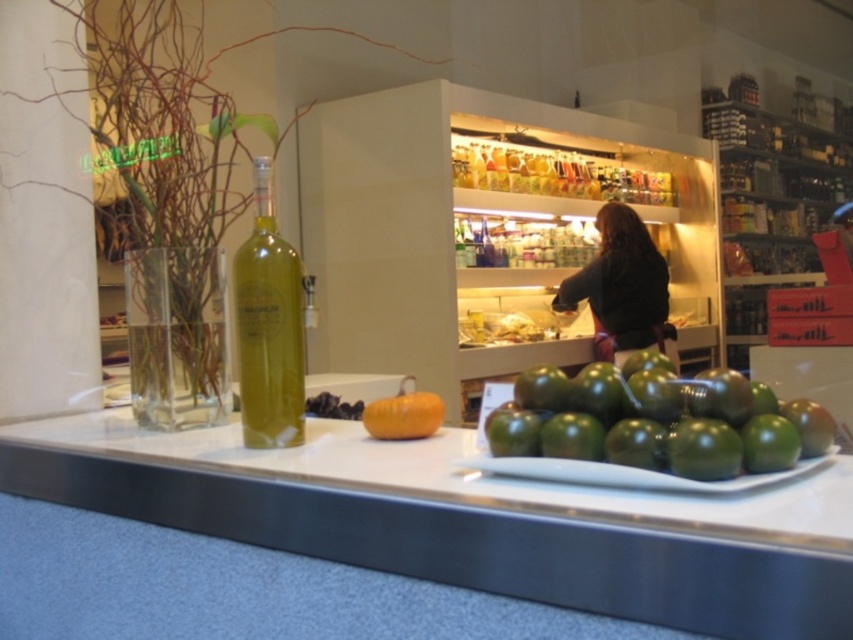
Question: Does green matte tomatoes at center lie behind black fabric at center?

Choices:
 (A) no
 (B) yes

Answer: (A)

Question: Considering the real-world distances, which object is closest to the green glass bottle at center?

Choices:
 (A) black fabric at center
 (B) orange matte pumpkin at center
 (C) white glossy counter at center

Answer: (B)

Question: In this image, where is white glossy counter at center located relative to green matte tomatoes at center?

Choices:
 (A) above
 (B) below

Answer: (B)

Question: Among these objects, which one is nearest to the camera?

Choices:
 (A) green matte tomatoes at center
 (B) orange matte pumpkin at center
 (C) green glass bottle at center

Answer: (A)

Question: Is green matte tomatoes at center closer to the viewer compared to orange matte pumpkin at center?

Choices:
 (A) yes
 (B) no

Answer: (A)

Question: Which point appears farthest from the camera in this image?

Choices:
 (A) (366, 412)
 (B) (317, 500)

Answer: (A)